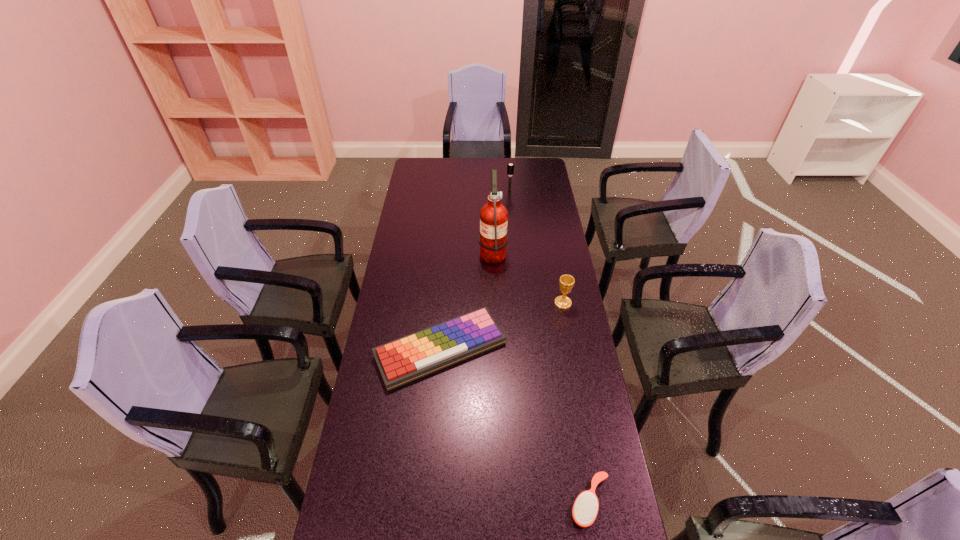
Locate an element on the screen. This screenshot has height=540, width=960. free space that is in between the shorter hairbrush and the chalice is located at coordinates (576, 402).

Find the location of a particular element. object that is the fourth nearest to the tallest object is located at coordinates (585, 509).

You are a GUI agent. You are given a task and a screenshot of the screen. Output one action in this format:
    pyautogui.click(x=<x>, y=<y>)
    Task: Click on the object identified as the fourth closest to the computer keyboard
    
    Given the screenshot: What is the action you would take?
    pyautogui.click(x=510, y=167)

This screenshot has height=540, width=960. In order to click on free location that satisfies the following two spatial constraints: 1. on the nozzle and handle of the shorter hairbrush; 2. on the right side of the fire extinguisher in this screenshot , I will do `click(500, 502)`.

What are the coordinates of `free space that satisfies the following two spatial constraints: 1. on the front side of the third nearest object; 2. on the right side of the left hairbrush` in the screenshot? It's located at (519, 303).

Image resolution: width=960 pixels, height=540 pixels. I want to click on vacant space that satisfies the following two spatial constraints: 1. on the nozzle and handle of the third nearest object; 2. on the right side of the fire extinguisher, so click(494, 303).